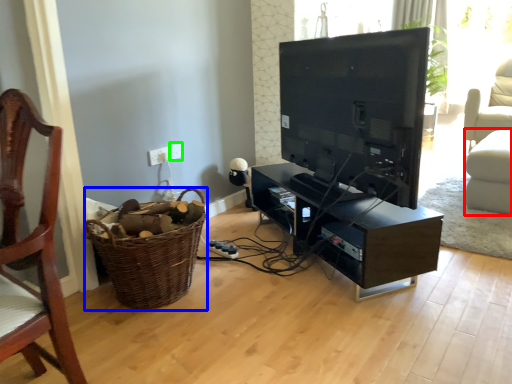
Question: Based on their relative distances, which object is nearer to swivel chair (highlighted by a red box)? Choose from basket (highlighted by a blue box) and electric outlet (highlighted by a green box).

Choices:
 (A) basket
 (B) electric outlet

Answer: (B)